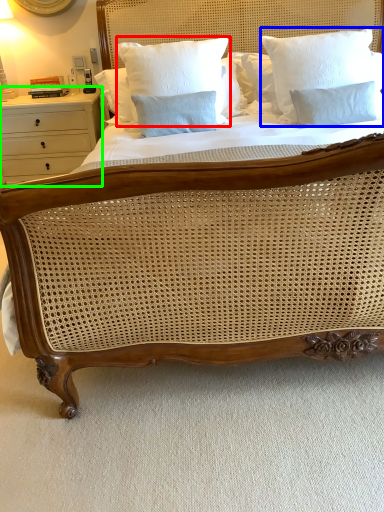
Question: Which is farther away from pillow (highlighted by a red box)? pillow (highlighted by a blue box) or nightstand (highlighted by a green box)?

Choices:
 (A) pillow
 (B) nightstand

Answer: (B)